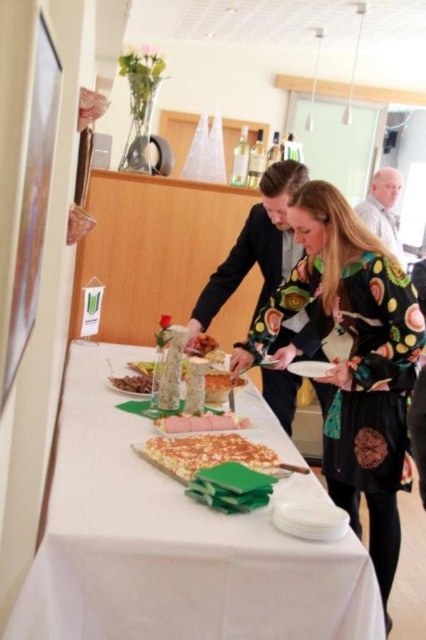
Is point (356, 465) farther from camera compared to point (396, 193)?

No, (356, 465) is closer to viewer.

Based on the photo, is floral-patterned dress at center bigger than white shirt at upper right?

Indeed, floral-patterned dress at center has a larger size compared to white shirt at upper right.

Identify the location of floral-patterned dress at center. This screenshot has width=426, height=640. (354, 358).

Consider the image. Which of these two, glazed pastry at center or sliced pink meat at center, stands taller?

glazed pastry at center

The image size is (426, 640). I want to click on glazed pastry at center, so click(x=204, y=452).

Between point (201, 442) and point (199, 424), which one is positioned behind?

Positioned behind is point (199, 424).

Image resolution: width=426 pixels, height=640 pixels. In order to click on glazed pastry at center in this screenshot , I will do `click(204, 452)`.

Which of these two, white paper plate at center or white shirt at upper right, stands shorter?

Standing shorter between the two is white paper plate at center.

Between white paper plate at center and white shirt at upper right, which one appears on the left side from the viewer's perspective?

white paper plate at center

Between point (253, 412) and point (385, 189), which one is positioned in front?

Point (253, 412) is more forward.

This screenshot has width=426, height=640. Identify the location of white paper plate at center. (170, 545).